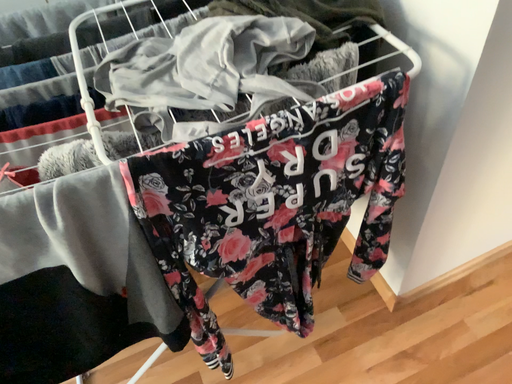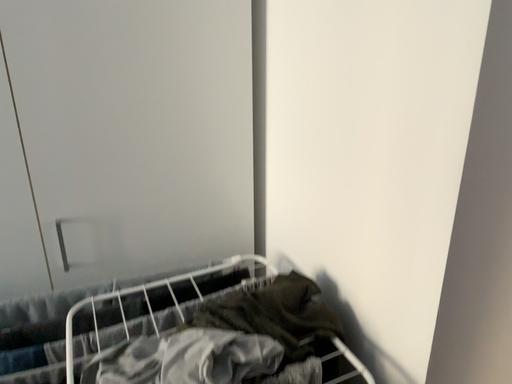
Question: How did the camera likely rotate when shooting the video?

Choices:
 (A) rotated upward
 (B) rotated downward

Answer: (A)